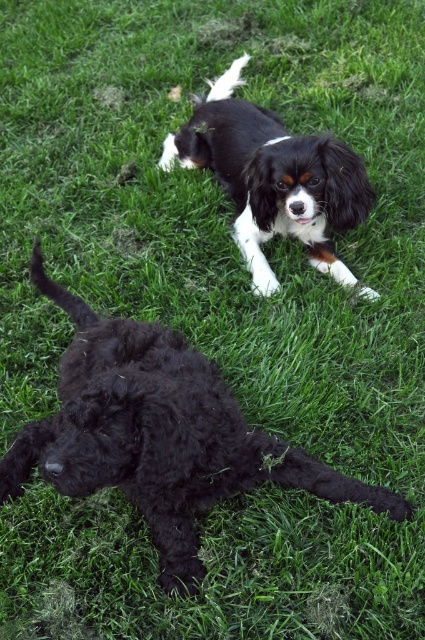
Is point (76, 436) less distant than point (292, 180)?

Yes, point (76, 436) is closer to viewer.

Can you confirm if fluffy black dog at lower left is wider than black silky dog at upper center?

Yes.

Is point (122, 344) in front of point (266, 150)?

Yes, it is.

Identify the location of fluffy black dog at lower left. (158, 435).